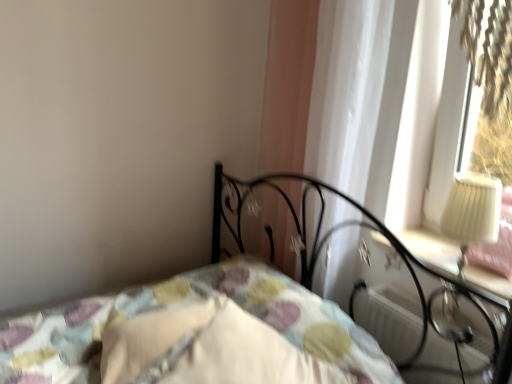
Where is `blank space situated above white plastic radiator at lower right (from a real-world perspective)`? The image size is (512, 384). blank space situated above white plastic radiator at lower right (from a real-world perspective) is located at coordinates (440, 314).